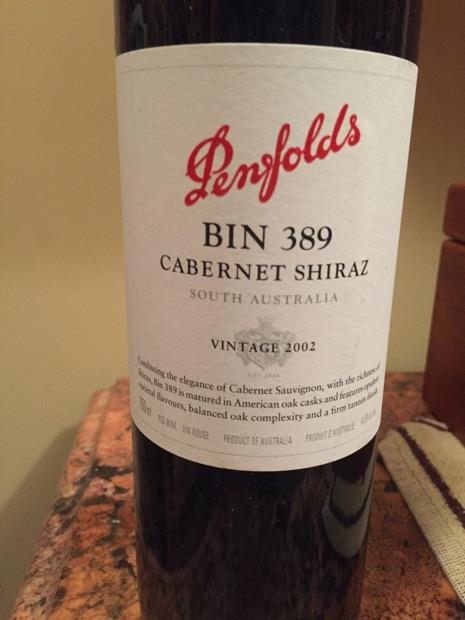
I want to click on place to put glass, so (117, 417).